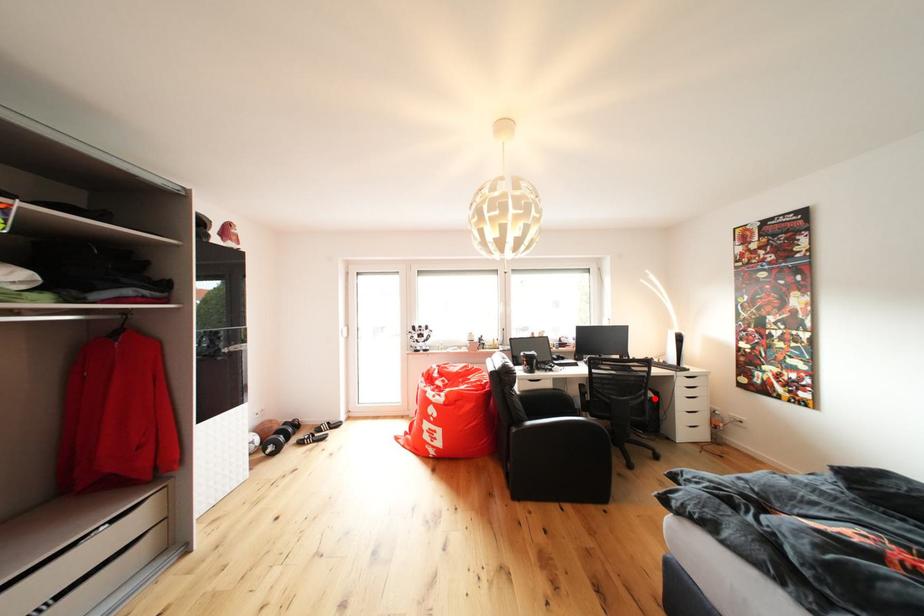
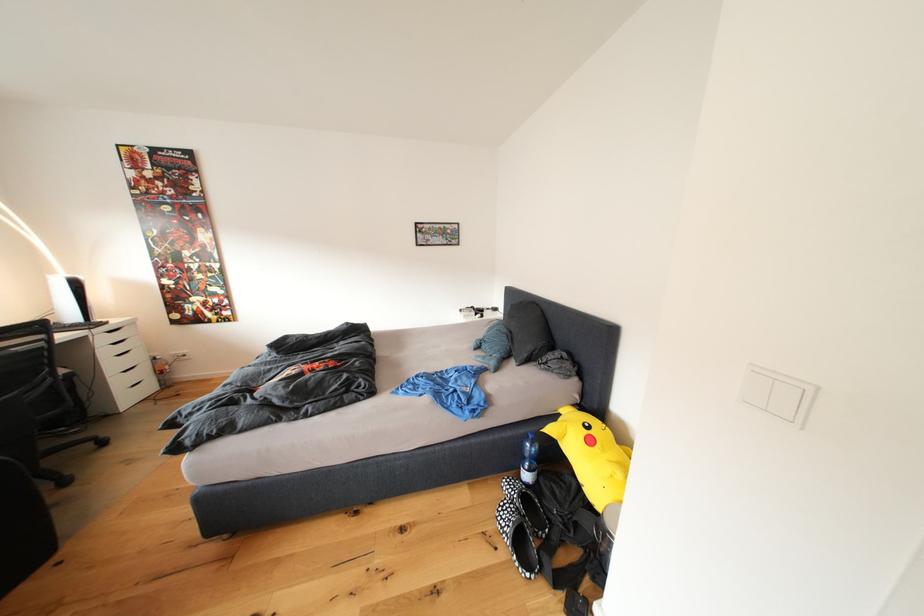
Question: I am providing you with two images of the same scene from different viewpoints. In image1, a red point is highlighted. Considering the same 3D point in image2, which of the following is correct?

Choices:
 (A) It is closer
 (B) It is farther

Answer: (B)